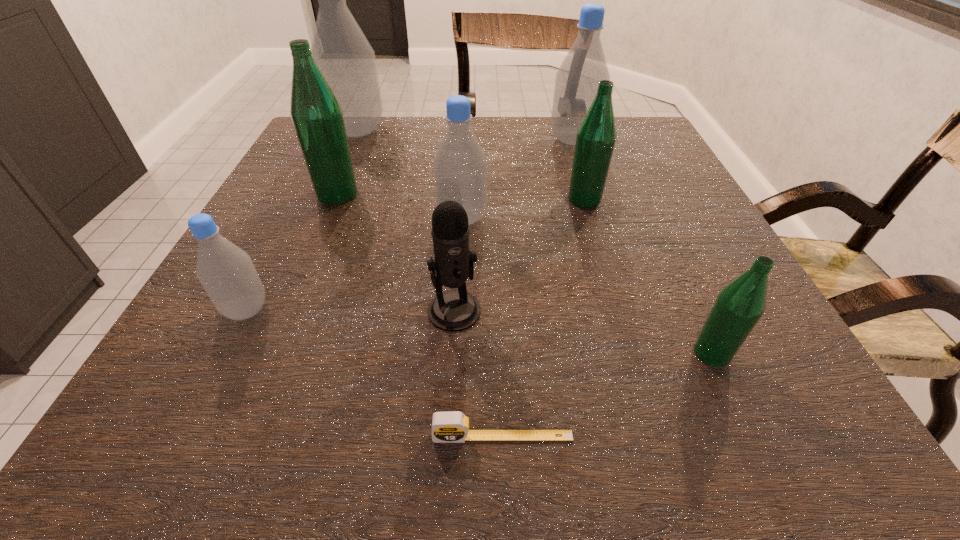
At what (x,y) coordinates should I click in order to perform the action: click on object that can be found as the fourth closest to the second smallest green bottle. Please return your answer as a coordinate pair (x, y). Looking at the image, I should click on (739, 306).

Point out which object is positioned as the fifth nearest to the biggest green bottle. Please provide its 2D coordinates. Your answer should be formatted as a tuple, i.e. [(x, y)], where the tuple contains the x and y coordinates of a point satisfying the conditions above.

[(596, 136)]

Locate an element on the screen. This screenshot has width=960, height=540. bottle that stands as the second closest to the second gray bottle from right to left is located at coordinates [316, 113].

Locate an element on the screen. This screenshot has width=960, height=540. the closest bottle relative to the nearest bottle is located at coordinates (596, 136).

You are a GUI agent. You are given a task and a screenshot of the screen. Output one action in this format:
    pyautogui.click(x=<x>, y=<y>)
    Task: Click on the second closest gray bottle to the tape measure
    The image size is (960, 540).
    Given the screenshot: What is the action you would take?
    pyautogui.click(x=460, y=165)

Select which gray bottle is the closest to the second nearest bottle. Please provide its 2D coordinates. Your answer should be formatted as a tuple, i.e. [(x, y)], where the tuple contains the x and y coordinates of a point satisfying the conditions above.

[(460, 165)]

Find the location of a particular element. green bottle that is the closest one to the biggest green bottle is located at coordinates (596, 136).

This screenshot has width=960, height=540. I want to click on the closest green bottle to the nearest bottle, so click(596, 136).

Where is `free space that satisfies the following two spatial constraints: 1. on the back side of the black microphone; 2. on the left side of the second nearest gray bottle`? The image size is (960, 540). free space that satisfies the following two spatial constraints: 1. on the back side of the black microphone; 2. on the left side of the second nearest gray bottle is located at coordinates (460, 218).

This screenshot has height=540, width=960. Find the location of `free location that satisfies the following two spatial constraints: 1. on the front side of the rightmost bottle; 2. on the right side of the smallest gray bottle`. free location that satisfies the following two spatial constraints: 1. on the front side of the rightmost bottle; 2. on the right side of the smallest gray bottle is located at coordinates (225, 353).